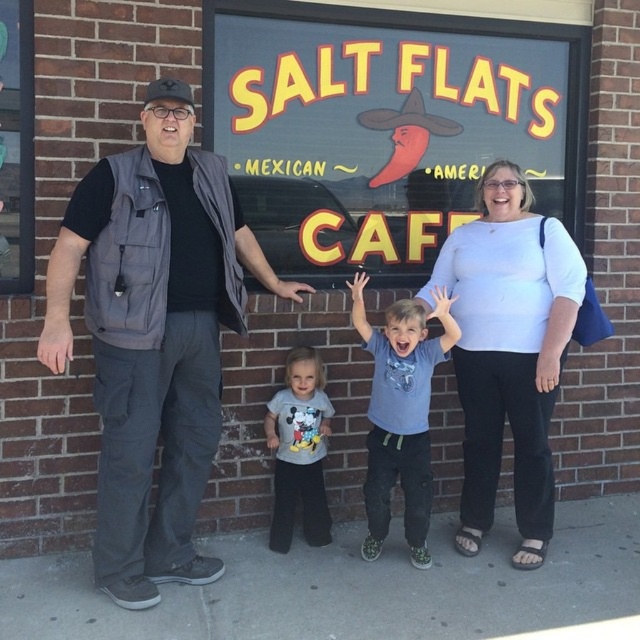
You are a photographer trying to capture the family in the scene. You want to ensure that both the gray vest at left and the gray cotton shirt at center are clearly visible in your shot. Based on their positions, which object should you focus on first to include both in the frame?

The gray vest at left is to the left of the gray cotton shirt at center, so you should focus on the gray vest at left first to ensure both are in the frame.

You are a photographer taking a picture of the gray vest at left and the white cotton shirt at center. Which clothing item is closer to the camera?

The gray vest at left is closer to the camera because it is in front of the white cotton shirt at center.

You are trying to decide which clothing item to purchase between the gray vest at left and the gray cotton shirt at center. Based on their sizes, which one is bigger?

The gray vest at left is larger in size compared to the gray cotton shirt at center.